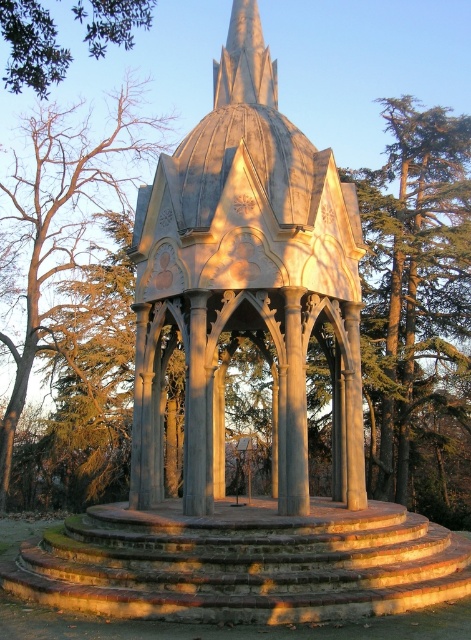
Question: From the image, what is the correct spatial relationship of green textured tree at right in relation to green leafy tree at upper left?

Choices:
 (A) above
 (B) below

Answer: (B)

Question: Which of these objects is positioned farthest from the green leafy tree at upper left?

Choices:
 (A) stone gazebo at center
 (B) green textured tree at right
 (C) brown leafless tree at left

Answer: (B)

Question: Which is farther from the stone gazebo at center?

Choices:
 (A) green leafy tree at upper left
 (B) green textured tree at right

Answer: (B)

Question: Observing the image, what is the correct spatial positioning of green textured tree at right in reference to brown leafless tree at left?

Choices:
 (A) left
 (B) right

Answer: (B)

Question: Is stone gazebo at center behind brown leafless tree at left?

Choices:
 (A) yes
 (B) no

Answer: (B)

Question: Based on their relative distances, which object is farther from the green textured tree at right?

Choices:
 (A) stone gazebo at center
 (B) green leafy tree at upper left

Answer: (B)